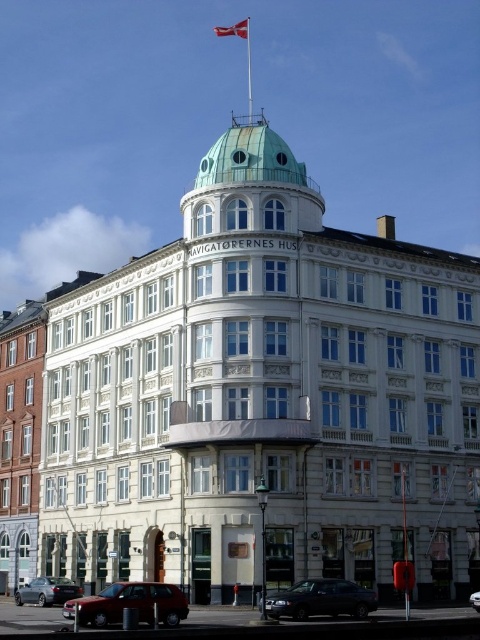
Is white glossy building at center below shiny black sedan at lower center?

Incorrect, white glossy building at center is not positioned below shiny black sedan at lower center.

Image resolution: width=480 pixels, height=640 pixels. I want to click on white glossy building at center, so point(264,396).

Can you confirm if red fabric flag at upper center is positioned to the left of metallic silver car at center?

Yes, red fabric flag at upper center is to the left of metallic silver car at center.

Which of these two, red fabric flag at upper center or metallic silver car at center, stands shorter?

metallic silver car at center

Where is `red fabric flag at upper center`? The image size is (480, 640). red fabric flag at upper center is located at coordinates (233, 29).

Does white glossy building at left have a lesser height compared to metallic silver car at center?

Incorrect, white glossy building at left's height does not fall short of metallic silver car at center's.

Is white glossy building at left smaller than metallic silver car at center?

Actually, white glossy building at left might be larger than metallic silver car at center.

Does point (34, 360) come behind point (478, 600)?

Yes, it is.

Where is `white glossy building at left`? The height and width of the screenshot is (640, 480). white glossy building at left is located at coordinates (20, 440).